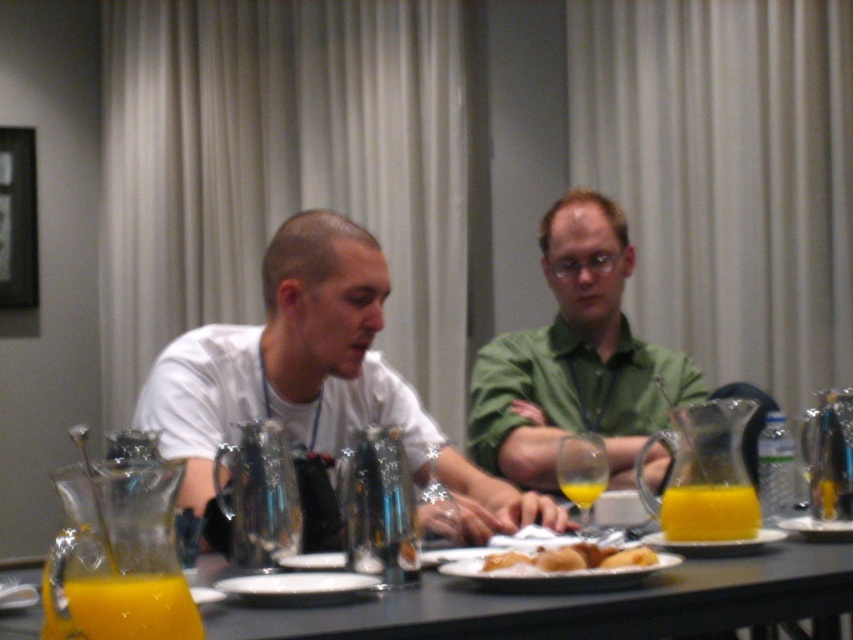
Question: Among these objects, which one is nearest to the camera?

Choices:
 (A) yellow translucent glass at center
 (B) matte white plate at center
 (C) yellow translucent pitcher at center
 (D) golden brown bread at center

Answer: (B)

Question: Does white matte shirt at center lie in front of matte white plate at center?

Choices:
 (A) no
 (B) yes

Answer: (A)

Question: Observing the image, what is the correct spatial positioning of green matte shirt at center in reference to golden brown bread at center?

Choices:
 (A) right
 (B) left

Answer: (A)

Question: Observing the image, what is the correct spatial positioning of white matte plate at center in reference to matte yellow plate at center?

Choices:
 (A) below
 (B) above

Answer: (A)

Question: Considering the real-world distances, which object is farthest from the translucent glass pitcher at center?

Choices:
 (A) yellow translucent glass at center
 (B) translucent glass pitcher of orange juice at table center
 (C) golden brown bread at center

Answer: (A)

Question: Which point is farther from the camera taking this photo?

Choices:
 (A) (721, 545)
 (B) (120, 624)

Answer: (A)